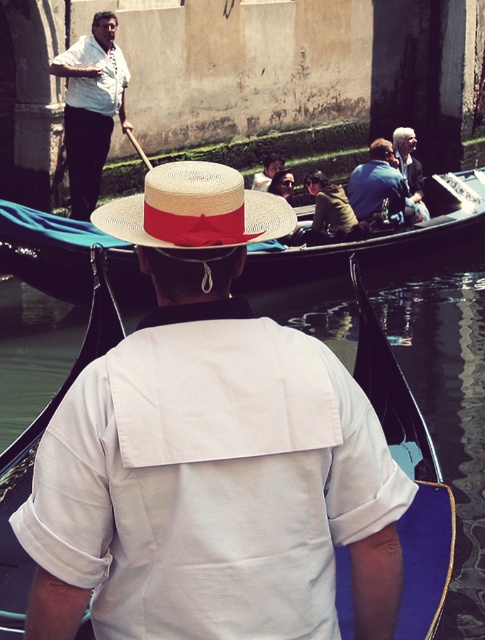
Can you confirm if matte straw hat at center is positioned to the left of blue denim jacket at upper center?

Indeed, matte straw hat at center is positioned on the left side of blue denim jacket at upper center.

Is matte straw hat at center further to the viewer compared to blue denim jacket at upper center?

No, matte straw hat at center is in front of blue denim jacket at upper center.

What do you see at coordinates (371, 236) in the screenshot?
I see `matte straw hat at center` at bounding box center [371, 236].

Find the location of `matte straw hat at center`. matte straw hat at center is located at coordinates (371, 236).

Does point (110, 20) come farther from viewer compared to point (278, 168)?

No, it is in front of (278, 168).

Which of these two, matte white shirt at upper left or smooth brown leather jacket at center, stands taller?

matte white shirt at upper left

Between point (82, 212) and point (256, 188), which one is positioned in front?

Positioned in front is point (82, 212).

You are a GUI agent. You are given a task and a screenshot of the screen. Output one action in this format:
    pyautogui.click(x=<x>, y=<y>)
    Task: Click on the matte white shirt at upper left
    This screenshot has width=485, height=640.
    Given the screenshot: What is the action you would take?
    pyautogui.click(x=91, y=108)

Measure the distance between point (283, 428) and camera.

The distance of point (283, 428) from camera is 25.25 feet.

Locate an element on the screen. The height and width of the screenshot is (640, 485). white cotton shirt at center is located at coordinates click(210, 483).

The width and height of the screenshot is (485, 640). In order to click on white cotton shirt at center in this screenshot , I will do `click(210, 483)`.